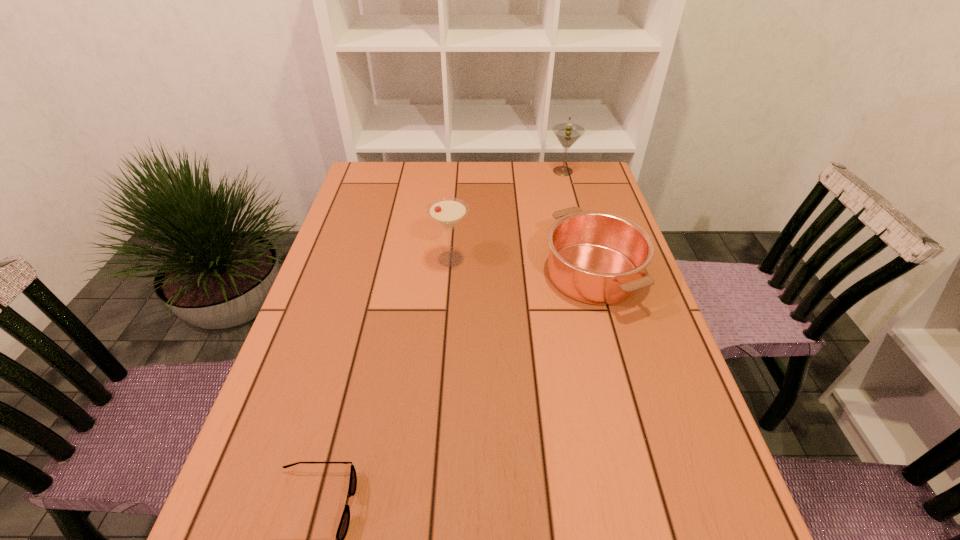
The height and width of the screenshot is (540, 960). Find the location of `saucepan at the right edge`. saucepan at the right edge is located at coordinates (595, 257).

The height and width of the screenshot is (540, 960). I want to click on object located in the far right corner section of the desktop, so click(567, 133).

Find the location of a particular element. vacant position at the far edge of the desktop is located at coordinates (525, 180).

The image size is (960, 540). In the image, there is a desktop. Identify the location of vacant region at the left edge. (377, 281).

Image resolution: width=960 pixels, height=540 pixels. In order to click on vacant space at the right edge of the desktop in this screenshot , I will do `click(640, 357)`.

The width and height of the screenshot is (960, 540). Identify the location of vacant area at the far right corner. (581, 187).

Locate an element on the screen. The image size is (960, 540). unoccupied position between the nearer martini and the third tallest object is located at coordinates (521, 266).

The image size is (960, 540). I want to click on free spot between the second object from left to right and the farthest object, so click(507, 215).

You are a GUI agent. You are given a task and a screenshot of the screen. Output one action in this format:
    pyautogui.click(x=<x>, y=<y>)
    Task: Click on the object identified as the closest to the second object from left to right
    
    Given the screenshot: What is the action you would take?
    tap(595, 257)

The height and width of the screenshot is (540, 960). Find the location of `object that stands as the second closest to the third tallest object`. object that stands as the second closest to the third tallest object is located at coordinates (567, 133).